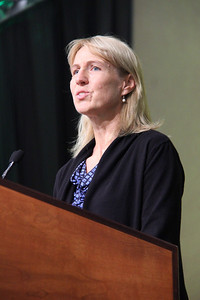
This screenshot has width=200, height=300. Find the location of `lamp`. lamp is located at coordinates (101, 103).